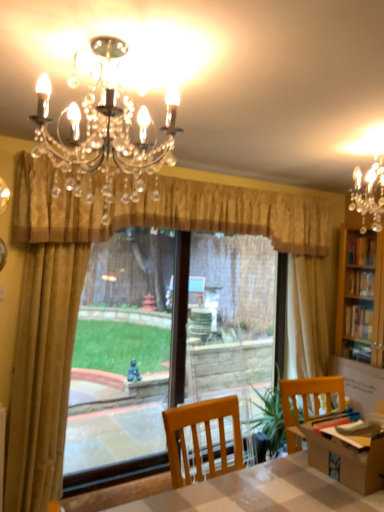
What do you see at coordinates (262, 492) in the screenshot? I see `smooth white table at center` at bounding box center [262, 492].

You are a GUI agent. You are given a task and a screenshot of the screen. Output one action in this format:
    pyautogui.click(x=<x>, y=<y>)
    Task: Click on the matte black chandelier at upper center
    This screenshot has width=384, height=512.
    Given the screenshot: What is the action you would take?
    pyautogui.click(x=102, y=125)

Measure the distance between point (252,236) and camera.

4.58 meters.

Where is `gold textured valance at center, which is counted as the 1th curtain, starting from the right`? gold textured valance at center, which is counted as the 1th curtain, starting from the right is located at coordinates (165, 210).

Identify the location of smooth white table at center. The width and height of the screenshot is (384, 512). (262, 492).

Is gold textured valance at center, the 2th curtain when ordered from left to right, inside the boundaries of smooth white table at center, or outside?

gold textured valance at center, the 2th curtain when ordered from left to right, is spatially situated outside smooth white table at center.

Which object is closer to the camera, gold textured valance at center, which is counted as the 1th curtain, starting from the right, or smooth white table at center?

smooth white table at center is more forward.

From the image's perspective, is gold textured valance at center, the 2th curtain when ordered from left to right, under smooth white table at center?

Incorrect, from the image's perspective, gold textured valance at center, the 2th curtain when ordered from left to right, is higher than smooth white table at center.

Considering the relative positions of gold textured valance at center, which is counted as the 1th curtain, starting from the right, and smooth white table at center in the image provided, is gold textured valance at center, which is counted as the 1th curtain, starting from the right, to the left of smooth white table at center from the viewer's perspective?

Indeed, gold textured valance at center, which is counted as the 1th curtain, starting from the right, is positioned on the left side of smooth white table at center.

Locate an element on the screen. curtain in front of the gold fabric curtain at left, placed as the second curtain when sorted from right to left is located at coordinates (165, 210).

Does gold textured valance at center, which is counted as the 1th curtain, starting from the right, lie behind gold fabric curtain at left, the 1th curtain from the left?

No, gold textured valance at center, which is counted as the 1th curtain, starting from the right, is closer to the viewer.

What's the angular difference between gold textured valance at center, the 2th curtain when ordered from left to right, and gold fabric curtain at left, placed as the second curtain when sorted from right to left,'s facing directions?

They differ by 0.0523 degrees in their facing directions.

Looking at this image, how far apart are gold textured valance at center, the 2th curtain when ordered from left to right, and gold fabric curtain at left, the 1th curtain from the left?

A distance of 31.87 inches exists between gold textured valance at center, the 2th curtain when ordered from left to right, and gold fabric curtain at left, the 1th curtain from the left.

Can you confirm if gold fabric curtain at left, placed as the second curtain when sorted from right to left, is positioned to the right of gold textured valance at center, the 2th curtain when ordered from left to right?

No, gold fabric curtain at left, placed as the second curtain when sorted from right to left, is not to the right of gold textured valance at center, the 2th curtain when ordered from left to right.

Is gold fabric curtain at left, the 1th curtain from the left, not close to gold textured valance at center, which is counted as the 1th curtain, starting from the right?

They are positioned close to each other.

Is smooth white table at center aimed at gold fabric curtain at left, placed as the second curtain when sorted from right to left?

No, smooth white table at center is not turned towards gold fabric curtain at left, placed as the second curtain when sorted from right to left.

Between smooth white table at center and gold fabric curtain at left, the 1th curtain from the left, which one has larger width?

smooth white table at center is wider.

Are smooth white table at center and gold fabric curtain at left, the 1th curtain from the left, beside each other?

smooth white table at center is not next to gold fabric curtain at left, the 1th curtain from the left, and they're not touching.

Looking at this image, from a real-world perspective, which is physically above, smooth white table at center or gold fabric curtain at left, placed as the second curtain when sorted from right to left?

From a 3D spatial view, gold fabric curtain at left, placed as the second curtain when sorted from right to left, is above.

Which is in front, translucent plastic screen door at center or matte black chandelier at upper center?

matte black chandelier at upper center.

Is matte black chandelier at upper center located within translucent plastic screen door at center?

No.

Is translucent plastic screen door at center positioned far away from matte black chandelier at upper center?

Indeed, translucent plastic screen door at center is not near matte black chandelier at upper center.

What are the coordinates of `screen door behind the matte black chandelier at upper center` in the screenshot? It's located at (232, 322).

In terms of width, does matte black chandelier at upper center look wider or thinner when compared to gold textured valance at center, the 2th curtain when ordered from left to right?

matte black chandelier at upper center is wider than gold textured valance at center, the 2th curtain when ordered from left to right.

How different are the orientations of matte black chandelier at upper center and gold textured valance at center, which is counted as the 1th curtain, starting from the right, in degrees?

The angular difference between matte black chandelier at upper center and gold textured valance at center, which is counted as the 1th curtain, starting from the right, is 89.9 degrees.

Considering the positions of points (114, 157) and (59, 236), is point (114, 157) closer to camera compared to point (59, 236)?

Yes, it is.

Can you confirm if matte black chandelier at upper center is smaller than gold textured valance at center, which is counted as the 1th curtain, starting from the right?

Yes.

In the image, is gold textured valance at center, which is counted as the 1th curtain, starting from the right, on the left side or the right side of matte black chandelier at upper center?

From the image, it's evident that gold textured valance at center, which is counted as the 1th curtain, starting from the right, is to the right of matte black chandelier at upper center.

How much distance is there between gold textured valance at center, which is counted as the 1th curtain, starting from the right, and matte black chandelier at upper center?

gold textured valance at center, which is counted as the 1th curtain, starting from the right, and matte black chandelier at upper center are 60.55 centimeters apart.

How different are the orientations of gold textured valance at center, which is counted as the 1th curtain, starting from the right, and matte black chandelier at upper center in degrees?

The angular difference between gold textured valance at center, which is counted as the 1th curtain, starting from the right, and matte black chandelier at upper center is 89.9 degrees.

Which object is thinner, gold textured valance at center, the 2th curtain when ordered from left to right, or matte black chandelier at upper center?

With smaller width is gold textured valance at center, the 2th curtain when ordered from left to right.

In the image, there is a gold textured valance at center, which is counted as the 1th curtain, starting from the right. Identify the location of table below it (from a real-world perspective). This screenshot has height=512, width=384. (262, 492).

At what (x,y) coordinates should I click in order to perform the action: click on curtain behind the gold textured valance at center, which is counted as the 1th curtain, starting from the right. Please return your answer as a coordinate pair (x, y). Image resolution: width=384 pixels, height=512 pixels. Looking at the image, I should click on (42, 373).

When comparing their distances from gold textured valance at center, which is counted as the 1th curtain, starting from the right, does smooth white table at center or translucent plastic screen door at center seem closer?

Based on the image, smooth white table at center appears to be nearer to gold textured valance at center, which is counted as the 1th curtain, starting from the right.

Considering their positions, is translucent plastic screen door at center positioned closer to matte black chandelier at upper center than smooth white table at center?

smooth white table at center lies closer to matte black chandelier at upper center than the other object.

From the image, which object appears to be farther from smooth white table at center, gold fabric curtain at left, placed as the second curtain when sorted from right to left, or translucent plastic screen door at center?

translucent plastic screen door at center is further to smooth white table at center.

Looking at the image, which one is located closer to matte black chandelier at upper center, translucent plastic screen door at center or gold fabric curtain at left, placed as the second curtain when sorted from right to left?

Among the two, gold fabric curtain at left, placed as the second curtain when sorted from right to left, is located nearer to matte black chandelier at upper center.

Estimate the real-world distances between objects in this image. Which object is further from gold fabric curtain at left, the 1th curtain from the left, matte black chandelier at upper center or gold textured valance at center, which is counted as the 1th curtain, starting from the right?

Among the two, matte black chandelier at upper center is located further to gold fabric curtain at left, the 1th curtain from the left.

Estimate the real-world distances between objects in this image. Which object is closer to gold textured valance at center, which is counted as the 1th curtain, starting from the right, matte black chandelier at upper center or gold fabric curtain at left, the 1th curtain from the left?

matte black chandelier at upper center lies closer to gold textured valance at center, which is counted as the 1th curtain, starting from the right, than the other object.

Looking at the image, which one is located closer to smooth white table at center, gold textured valance at center, the 2th curtain when ordered from left to right, or gold fabric curtain at left, placed as the second curtain when sorted from right to left?

gold fabric curtain at left, placed as the second curtain when sorted from right to left.

Which object lies nearer to the anchor point matte black chandelier at upper center, gold fabric curtain at left, the 1th curtain from the left, or smooth white table at center?

gold fabric curtain at left, the 1th curtain from the left.

Locate an element on the screen. curtain between matte black chandelier at upper center and gold fabric curtain at left, the 1th curtain from the left, along the z-axis is located at coordinates (165, 210).

The width and height of the screenshot is (384, 512). In order to click on table between matte black chandelier at upper center and translucent plastic screen door at center along the z-axis in this screenshot , I will do `click(262, 492)`.

Where is `curtain that lies between gold textured valance at center, which is counted as the 1th curtain, starting from the right, and smooth white table at center from top to bottom`? The image size is (384, 512). curtain that lies between gold textured valance at center, which is counted as the 1th curtain, starting from the right, and smooth white table at center from top to bottom is located at coordinates coord(42,373).

I want to click on curtain between gold fabric curtain at left, placed as the second curtain when sorted from right to left, and translucent plastic screen door at center, in the horizontal direction, so click(x=165, y=210).